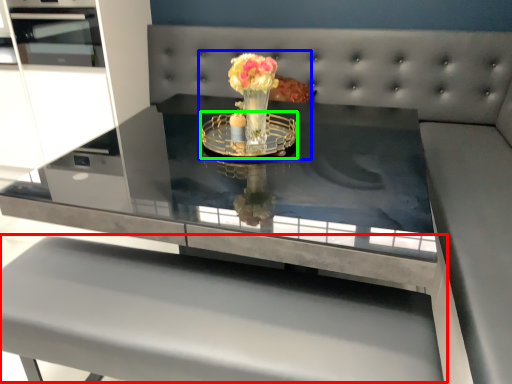
Question: Considering the real-world distances, which object is closest to table (highlighted by a red box)? floral arrangement (highlighted by a blue box) or glass plate (highlighted by a green box).

Choices:
 (A) floral arrangement
 (B) glass plate

Answer: (B)